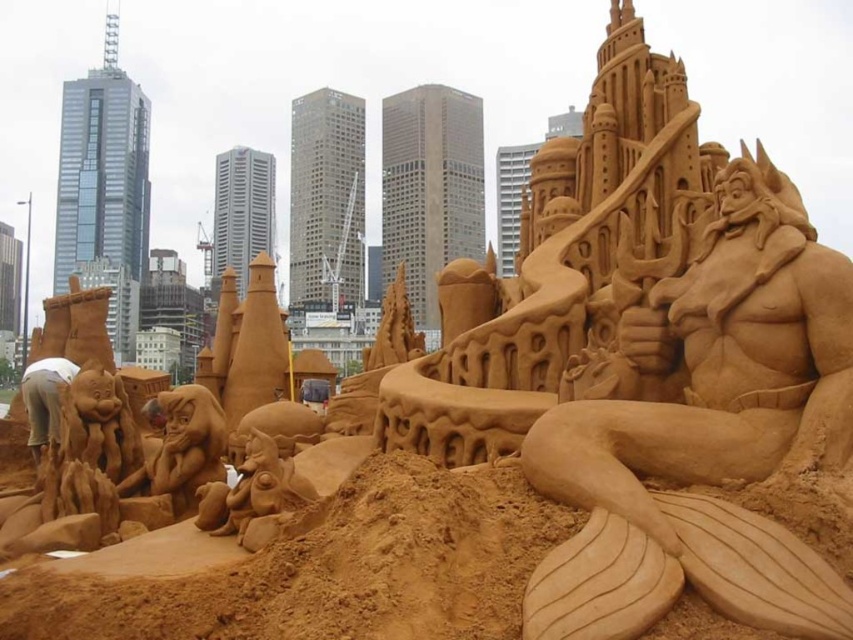
Question: Where is brown sand merman at center located in relation to brown sand sculpture at lower center in the image?

Choices:
 (A) left
 (B) right

Answer: (B)

Question: Based on their relative distances, which object is nearer to the brown sand sculpture at lower center?

Choices:
 (A) brown sand merman at center
 (B) brown sand sculpture at lower left

Answer: (A)

Question: Which of the following is the farthest from the observer?

Choices:
 (A) (819, 252)
 (B) (519, 570)
 (C) (41, 410)

Answer: (C)

Question: Among these objects, which one is farthest from the camera?

Choices:
 (A) brown sand sculpture at lower left
 (B) brown sand merman at center

Answer: (A)

Question: Does brown sand merman at center appear over brown sand sculpture at lower left?

Choices:
 (A) no
 (B) yes

Answer: (B)

Question: Is brown sand merman at center behind brown sand sculpture at lower left?

Choices:
 (A) yes
 (B) no

Answer: (B)